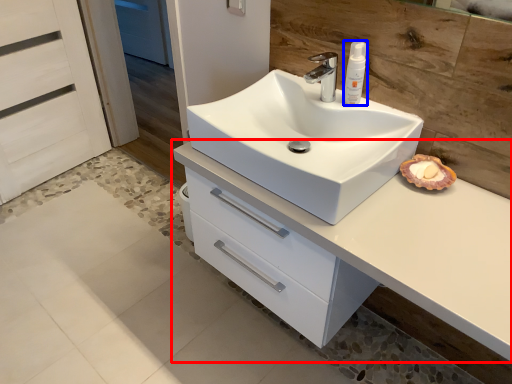
Question: Which point is further to the camera, bathroom cabinet (highlighted by a red box) or toiletry (highlighted by a blue box)?

Choices:
 (A) bathroom cabinet
 (B) toiletry

Answer: (B)